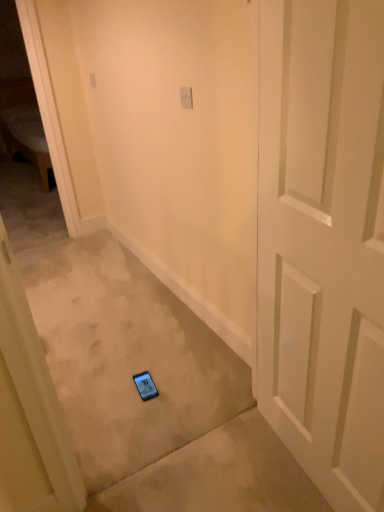
Question: Is white plastic light switch at upper center, which ranks as the 2th light switch in top-to-bottom order, taller or shorter than white matte door at center?

Choices:
 (A) short
 (B) tall

Answer: (A)

Question: From a real-world perspective, is white plastic light switch at upper center, which ranks as the 2th light switch in top-to-bottom order, above or below white matte door at center?

Choices:
 (A) below
 (B) above

Answer: (B)

Question: Estimate the real-world distances between objects in this image. Which object is closer to the white matte door at center?

Choices:
 (A) white plastic light switch at upper center, which ranks as the 2th light switch in top-to-bottom order
 (B) white plastic light switch at upper center, which is the second light switch in bottom-to-top order

Answer: (A)

Question: Estimate the real-world distances between objects in this image. Which object is farther from the white plastic light switch at upper center, the 2th light switch viewed from the front?

Choices:
 (A) white matte door at center
 (B) white plastic light switch at upper center, which ranks as the 2th light switch in top-to-bottom order

Answer: (A)